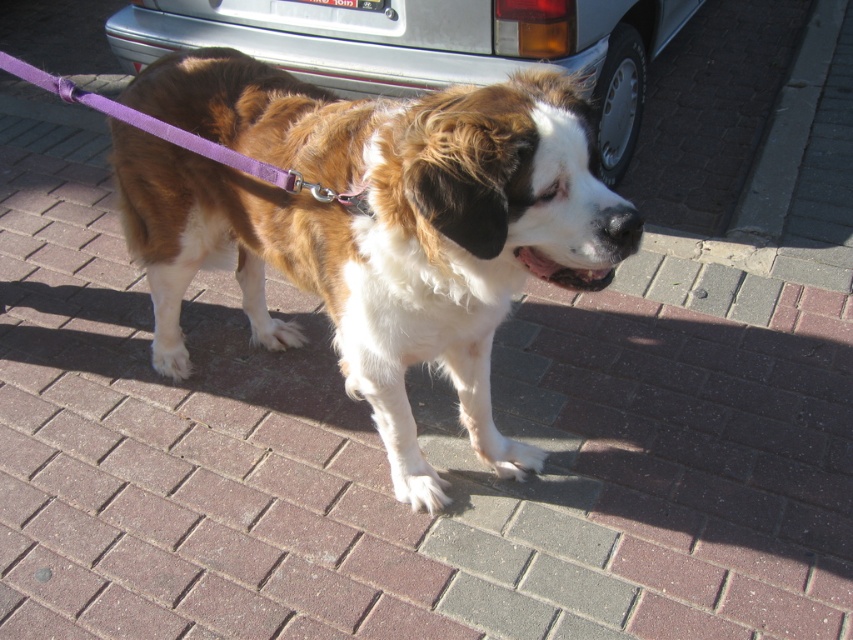
Question: Observing the image, what is the correct spatial positioning of brown/white fur dog at center in reference to white glossy car at upper center?

Choices:
 (A) below
 (B) above

Answer: (A)

Question: Which point appears closest to the camera in this image?

Choices:
 (A) click(x=234, y=152)
 (B) click(x=299, y=61)

Answer: (A)

Question: Which point appears closest to the camera in this image?

Choices:
 (A) (318, 188)
 (B) (151, 44)

Answer: (A)

Question: Based on their relative distances, which object is farther from the brown/white fur dog at center?

Choices:
 (A) white glossy car at upper center
 (B) purple fabric leash at center

Answer: (A)

Question: Can you confirm if white glossy car at upper center is positioned to the left of purple fabric leash at center?

Choices:
 (A) yes
 (B) no

Answer: (B)

Question: Does white glossy car at upper center have a greater width compared to purple fabric leash at center?

Choices:
 (A) yes
 (B) no

Answer: (A)